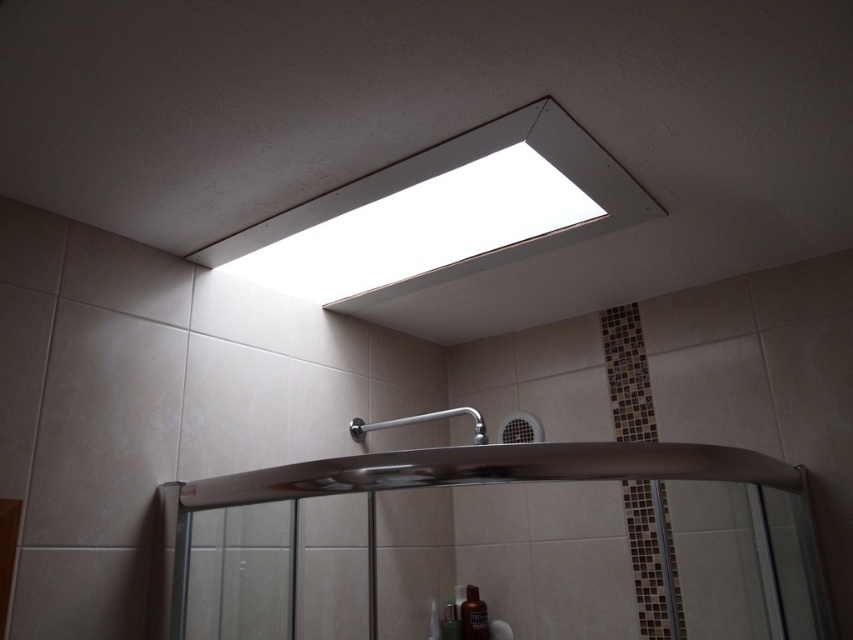
Question: Which object appears closest to the camera in this image?

Choices:
 (A) clear glass shower door at center
 (B) white fluorescent light at upper center

Answer: (A)

Question: Can you confirm if clear glass shower door at center is bigger than white fluorescent light at upper center?

Choices:
 (A) no
 (B) yes

Answer: (B)

Question: Estimate the real-world distances between objects in this image. Which object is farther from the white fluorescent light at upper center?

Choices:
 (A) clear glass shower door at center
 (B) satin nickel shower at center
 (C) translucent plastic bottle at lower center

Answer: (C)

Question: Is white fluorescent light at upper center positioned in front of translucent plastic bottle at lower center?

Choices:
 (A) yes
 (B) no

Answer: (A)

Question: Considering the real-world distances, which object is closest to the white fluorescent light at upper center?

Choices:
 (A) translucent plastic bottle at lower center
 (B) clear glass shower door at center

Answer: (B)

Question: Is satin nickel shower at center positioned behind translucent plastic bottle at lower center?

Choices:
 (A) yes
 (B) no

Answer: (B)